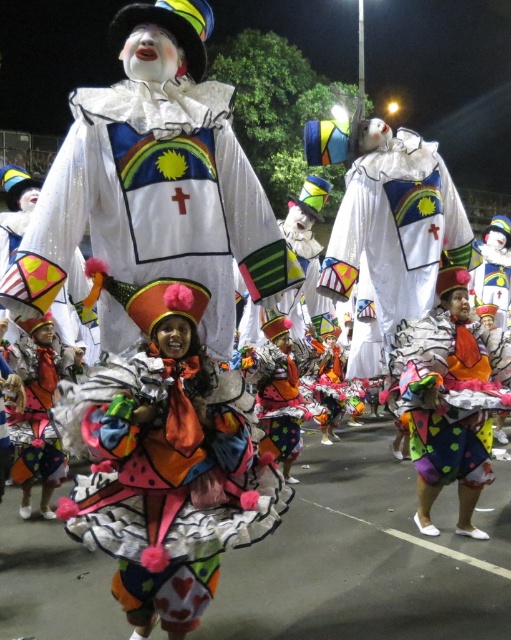
Does point (170, 378) come closer to viewer compared to point (472, 355)?

Yes, it is in front of point (472, 355).

Which is more to the right, multicolored fabric dress at center or multicolored fabric clown at center?

From the viewer's perspective, multicolored fabric clown at center appears more on the right side.

Measure the distance between multicolored fabric dress at center and camera.

They are 7.01 feet apart.

What are the coordinates of `multicolored fabric dress at center` in the screenshot? It's located at (167, 481).

Does white matte clown at center have a lesser height compared to multicolored fabric doll at center?

No, white matte clown at center is not shorter than multicolored fabric doll at center.

Between point (449, 241) and point (41, 472), which one is positioned behind?

The point (41, 472) is more distant.

Between point (429, 296) and point (39, 344), which one is positioned behind?

The point (39, 344) is behind.

Identify the location of white matte clown at center. (394, 228).

Measure the distance between point (142, 269) and camera.

Point (142, 269) is 2.44 meters away from camera.

At what (x,y) coordinates should I click in order to perform the action: click on white glittery clown at center. Please return your answer as a coordinate pair (x, y). The width and height of the screenshot is (511, 640). Looking at the image, I should click on (153, 202).